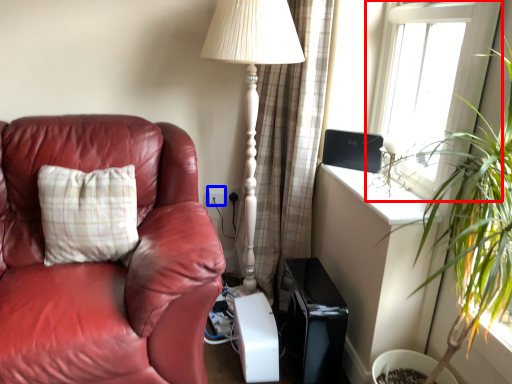
Question: Among these objects, which one is nearest to the camera, window (highlighted by a red box) or electric outlet (highlighted by a blue box)?

Choices:
 (A) window
 (B) electric outlet

Answer: (A)